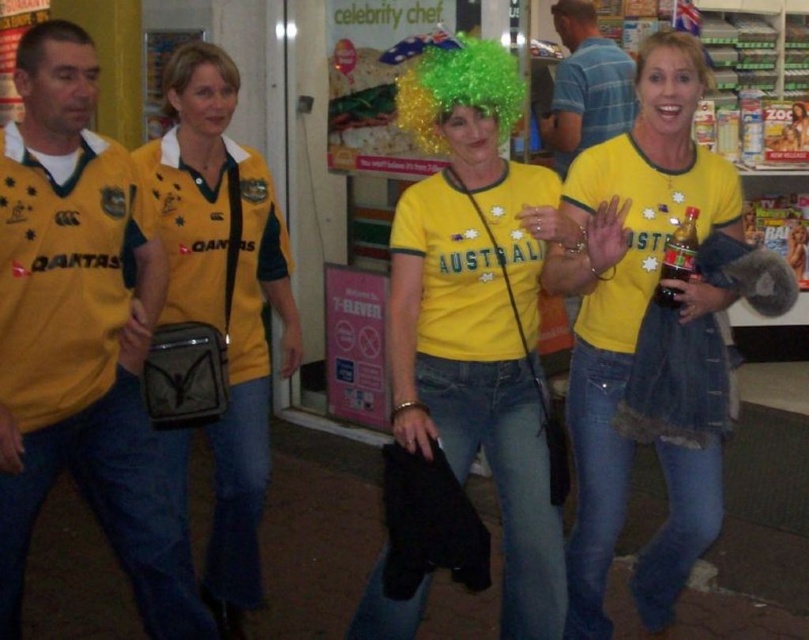
Who is more distant from viewer, (263,458) or (70,35)?

The point (263,458) is behind.

Is point (227, 556) positioned in front of point (28, 49)?

No, (227, 556) is behind (28, 49).

Find the location of a particular element. yellow matte jersey at center is located at coordinates (223, 300).

Is yellow jersey at center below green curly wig at center?

Correct, yellow jersey at center is located below green curly wig at center.

How far apart are yellow jersey at center and green curly wig at center?

yellow jersey at center and green curly wig at center are 75.75 centimeters apart from each other.

The width and height of the screenshot is (809, 640). I want to click on yellow jersey at center, so click(x=629, y=296).

Where is `yellow jersey at center`? yellow jersey at center is located at coordinates (629, 296).

Can you confirm if shiny yellow wig at center is positioned above yellow matte jersey at center?

Yes.

Where is `shiny yellow wig at center`? The width and height of the screenshot is (809, 640). shiny yellow wig at center is located at coordinates (477, 308).